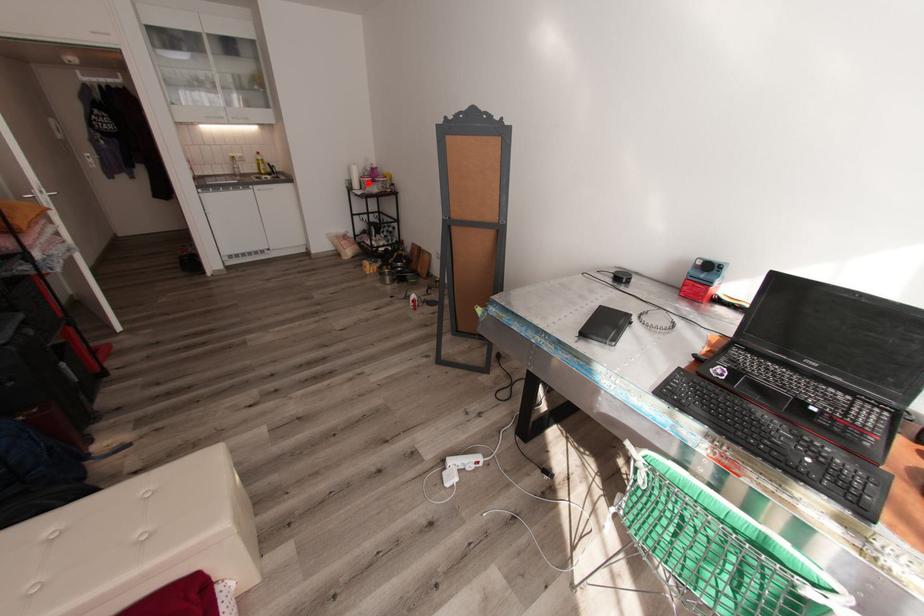
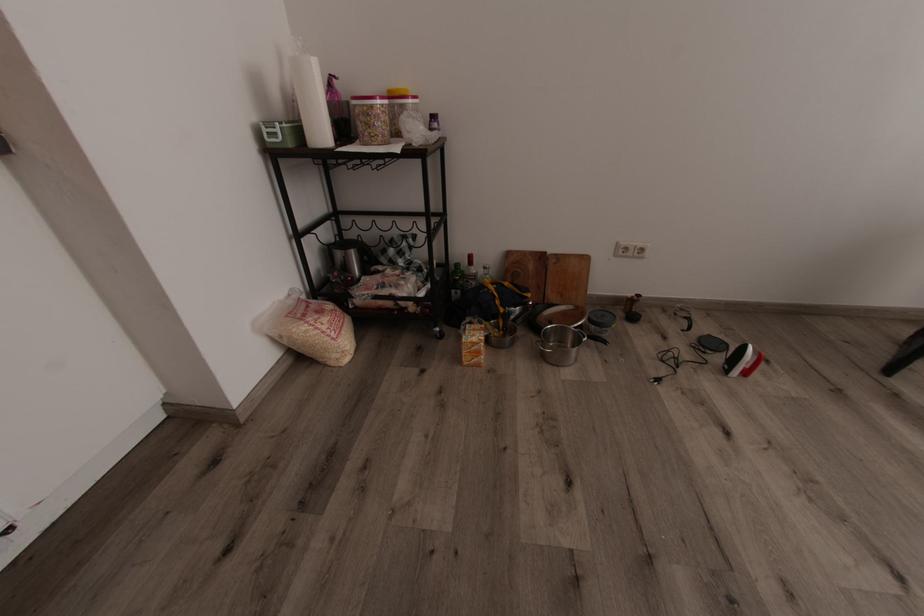
Question: I am providing you with two images of the same scene from different viewpoints. A red point is marked on the first image. At the location where the point appears in image 1, is it still visible in image 2?

Choices:
 (A) Yes
 (B) No

Answer: (A)